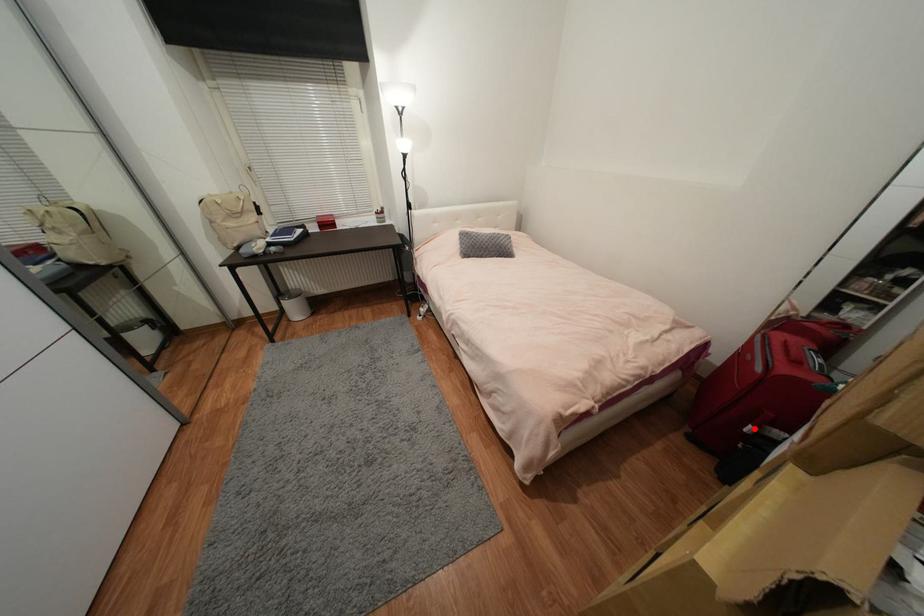
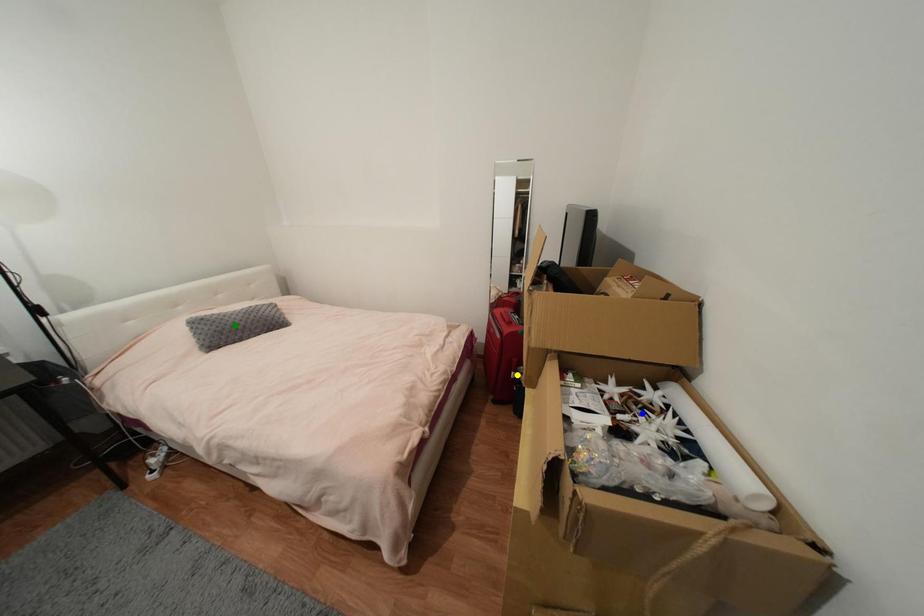
Question: I am providing you with two images of the same scene from different viewpoints. A red point is marked on the first image. You are given multiple points on the second image. Which point in image 2 represents the same 3d spot as the red point in image 1?

Choices:
 (A) green point
 (B) yellow point
 (C) blue point

Answer: (B)